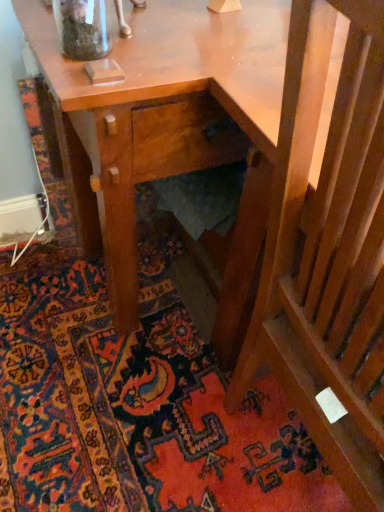
Question: From the image's perspective, is carpeted stairs at lower right on top of wooden slats at lower right?

Choices:
 (A) yes
 (B) no

Answer: (B)

Question: Considering the relative sizes of carpeted stairs at lower right and wooden slats at lower right in the image provided, is carpeted stairs at lower right wider than wooden slats at lower right?

Choices:
 (A) yes
 (B) no

Answer: (A)

Question: Is carpeted stairs at lower right oriented away from wooden slats at lower right?

Choices:
 (A) no
 (B) yes

Answer: (A)

Question: Is carpeted stairs at lower right further to camera compared to wooden slats at lower right?

Choices:
 (A) no
 (B) yes

Answer: (B)

Question: From a real-world perspective, is carpeted stairs at lower right over wooden slats at lower right?

Choices:
 (A) no
 (B) yes

Answer: (A)

Question: Is point (104, 6) closer or farther from the camera than point (4, 285)?

Choices:
 (A) closer
 (B) farther

Answer: (A)

Question: Would you say clear glass jar at upper left is inside or outside carpeted stairs at lower right?

Choices:
 (A) inside
 (B) outside

Answer: (B)

Question: From a real-world perspective, is clear glass jar at upper left physically located above or below carpeted stairs at lower right?

Choices:
 (A) above
 (B) below

Answer: (A)

Question: Is clear glass jar at upper left bigger or smaller than carpeted stairs at lower right?

Choices:
 (A) big
 (B) small

Answer: (B)

Question: Is wooden slats at lower right bigger or smaller than carpeted stairs at lower right?

Choices:
 (A) small
 (B) big

Answer: (B)

Question: Considering the relative positions of wooden slats at lower right and carpeted stairs at lower right in the image provided, is wooden slats at lower right to the left or to the right of carpeted stairs at lower right?

Choices:
 (A) right
 (B) left

Answer: (A)

Question: Choose the correct answer: Is wooden slats at lower right inside carpeted stairs at lower right or outside it?

Choices:
 (A) outside
 (B) inside

Answer: (A)

Question: In the image, is wooden slats at lower right positioned in front of or behind carpeted stairs at lower right?

Choices:
 (A) front
 (B) behind

Answer: (A)

Question: Is carpeted stairs at lower right bigger or smaller than clear glass jar at upper left?

Choices:
 (A) big
 (B) small

Answer: (A)

Question: In terms of height, does carpeted stairs at lower right look taller or shorter compared to clear glass jar at upper left?

Choices:
 (A) tall
 (B) short

Answer: (B)